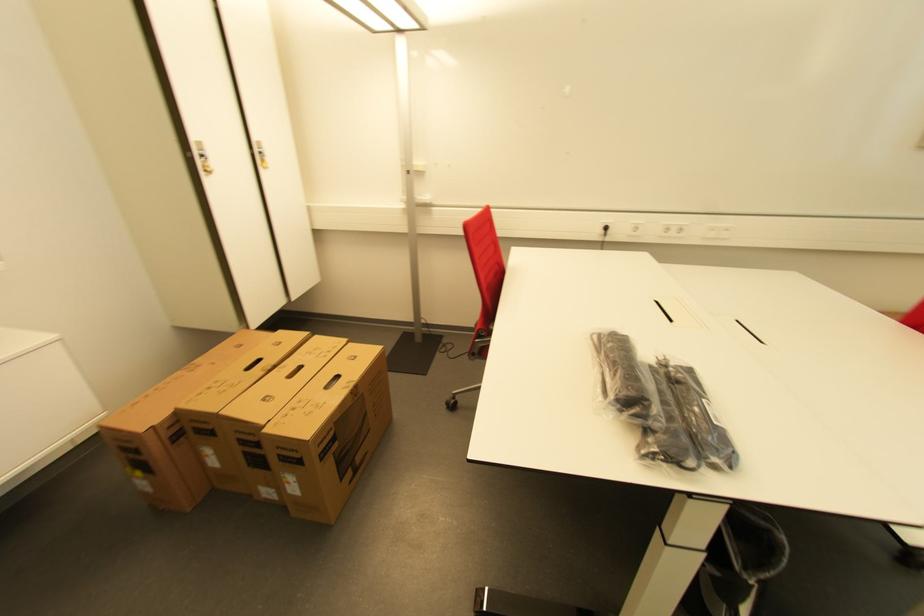
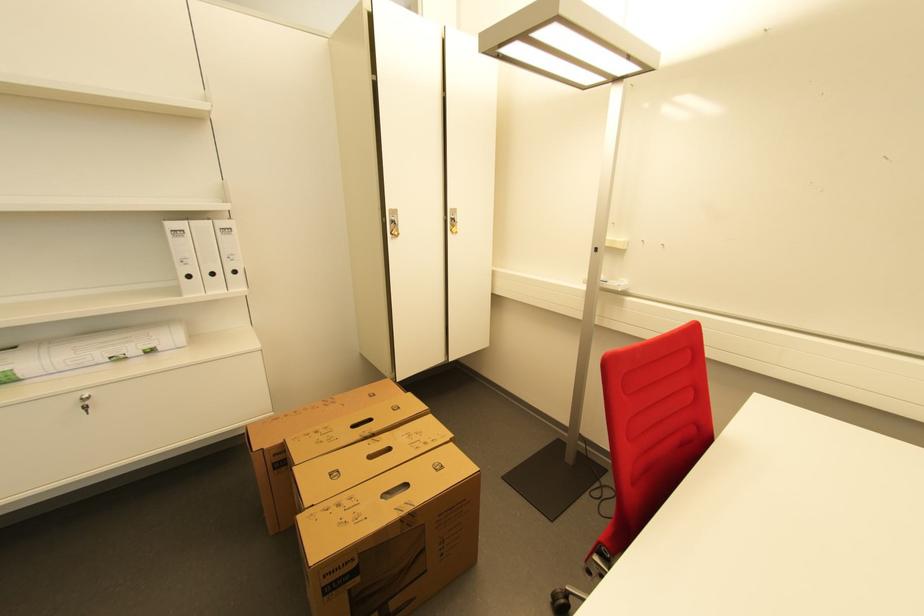
The point at (332, 389) is marked in the first image. Where is the corresponding point in the second image?

(388, 496)